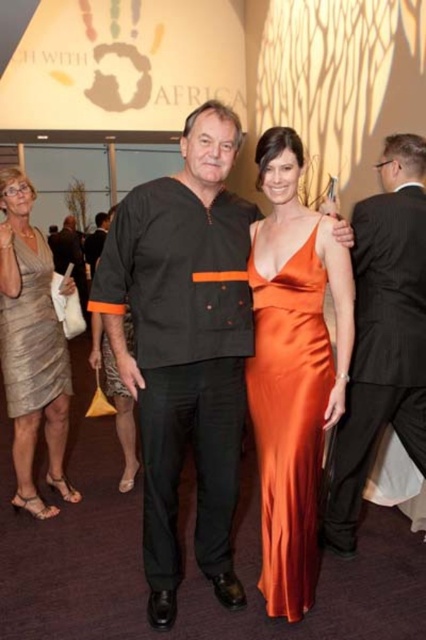
Question: Which object appears closest to the camera in this image?

Choices:
 (A) shiny orange dress at center
 (B) metallic gold dress at left
 (C) shiny silver dress at center
 (D) satin black suit at center

Answer: (A)

Question: Does shiny silver dress at center appear over metallic gold dress at left?

Choices:
 (A) yes
 (B) no

Answer: (B)

Question: Based on their relative distances, which object is farther from the black matte shirt at center?

Choices:
 (A) metallic gold dress at left
 (B) shiny silver dress at center

Answer: (B)

Question: Based on their relative distances, which object is nearer to the shiny silver dress at center?

Choices:
 (A) shiny orange dress at center
 (B) black matte shirt at center
 (C) satin black suit at center

Answer: (B)

Question: Is shiny orange dress at center further to the viewer compared to metallic gold dress at left?

Choices:
 (A) no
 (B) yes

Answer: (A)

Question: Is satin black suit at center bigger than shiny silver dress at center?

Choices:
 (A) no
 (B) yes

Answer: (A)